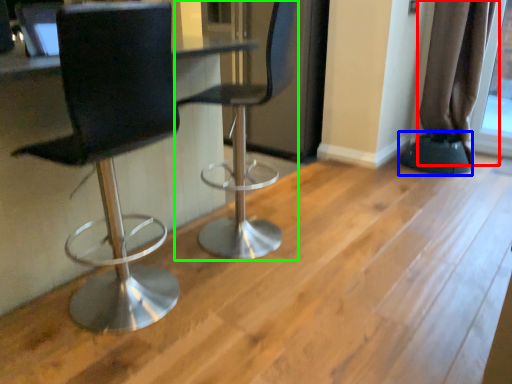
Question: Which object is positioned closest to curtain (highlighted by a red box)? Select from step stool (highlighted by a blue box) and chair (highlighted by a green box).

Choices:
 (A) step stool
 (B) chair

Answer: (A)